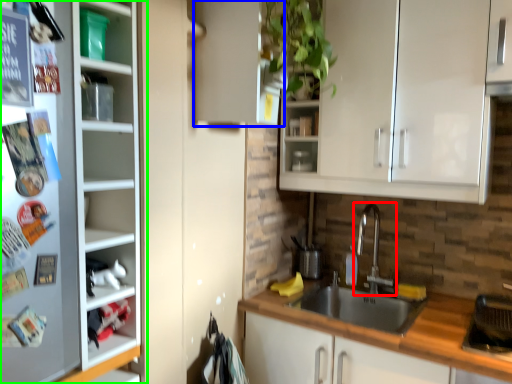
Question: Which object is the farthest from tap (highlighted by a red box)? Choose among these: cabinetry (highlighted by a blue box) or cupboard (highlighted by a green box).

Choices:
 (A) cabinetry
 (B) cupboard

Answer: (B)